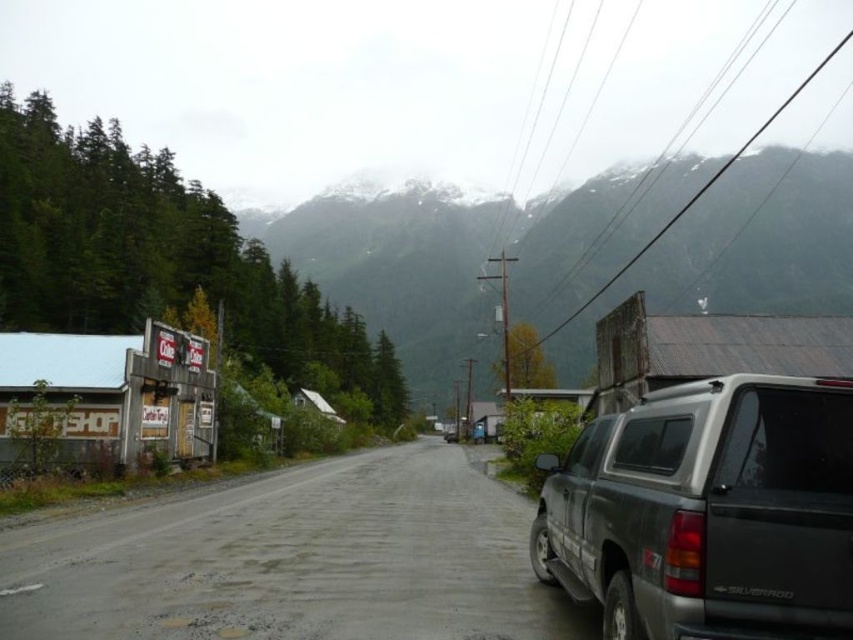
Question: Which point is closer to the camera taking this photo?

Choices:
 (A) (379, 275)
 (B) (625, 557)

Answer: (B)

Question: Which object is closer to the camera taking this photo?

Choices:
 (A) snowy rock mountain at upper center
 (B) matte gray minivan at right

Answer: (B)

Question: In this image, where is snowy rock mountain at upper center located relative to black plastic license plate at right?

Choices:
 (A) below
 (B) above

Answer: (B)

Question: Does snowy rock mountain at upper center come in front of matte gray minivan at right?

Choices:
 (A) yes
 (B) no

Answer: (B)

Question: Which point is closer to the camera?

Choices:
 (A) matte gray minivan at right
 (B) black plastic license plate at right

Answer: (A)

Question: Is matte gray minivan at right wider than black plastic license plate at right?

Choices:
 (A) no
 (B) yes

Answer: (B)